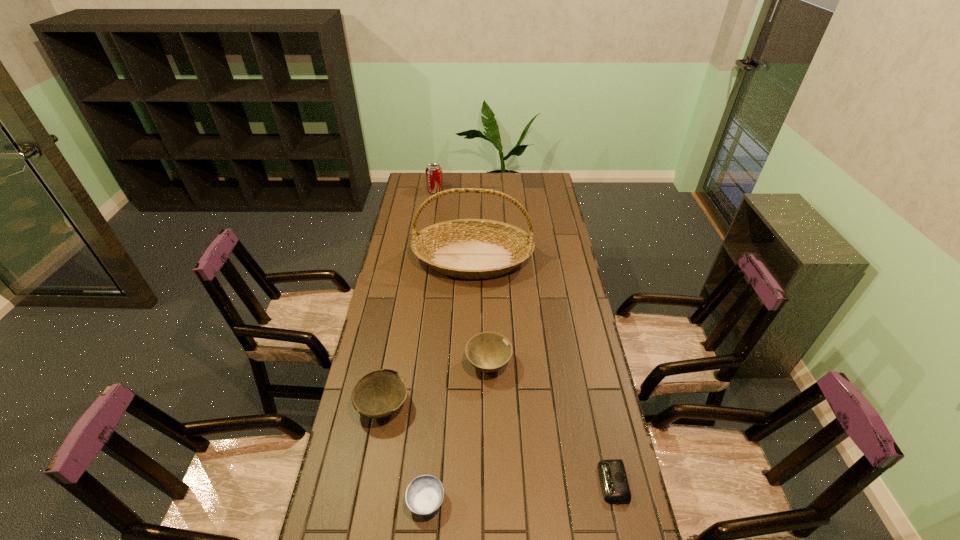
Where is `bowl present at the left edge`? The image size is (960, 540). bowl present at the left edge is located at coordinates (378, 394).

I want to click on object at the right edge, so click(614, 483).

Where is `object that is at the far left corner`? This screenshot has height=540, width=960. object that is at the far left corner is located at coordinates (434, 179).

You are a GUI agent. You are given a task and a screenshot of the screen. Output one action in this format:
    pyautogui.click(x=<x>, y=<y>)
    Task: Click on the blank area at the far edge
    The image size is (960, 540).
    Given the screenshot: What is the action you would take?
    pyautogui.click(x=472, y=194)

In the image, there is a desktop. Where is `vacant space at the left edge`? Image resolution: width=960 pixels, height=540 pixels. vacant space at the left edge is located at coordinates (410, 332).

You are a GUI agent. You are given a task and a screenshot of the screen. Output one action in this format:
    pyautogui.click(x=<x>, y=<y>)
    Task: Click on the free region at the right edge of the desktop
    This screenshot has height=540, width=960.
    Given the screenshot: What is the action you would take?
    pyautogui.click(x=559, y=361)

Where is `vacant space at the far left corner of the desktop`? Image resolution: width=960 pixels, height=540 pixels. vacant space at the far left corner of the desktop is located at coordinates (421, 184).

Locate an element on the screen. This screenshot has width=960, height=540. free space between the fifth nearest object and the ashtray is located at coordinates (449, 380).

I want to click on vacant area that lies between the right bowl and the alarm clock, so click(x=551, y=424).

Locate an element on the screen. This screenshot has height=540, width=960. unoccupied position between the second shortest object and the soda can is located at coordinates (431, 346).